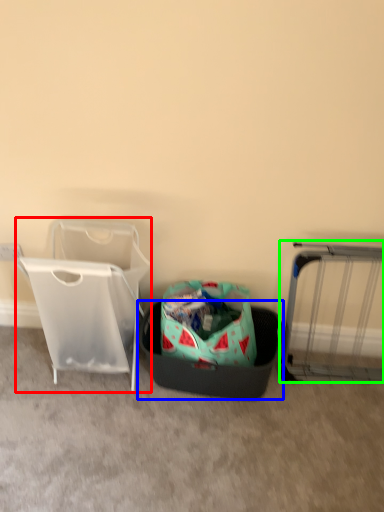
Question: Estimate the real-world distances between objects in this image. Which object is closer to baby carriage (highlighted by a red box), laundry basket (highlighted by a blue box) or furniture (highlighted by a green box)?

Choices:
 (A) laundry basket
 (B) furniture

Answer: (A)